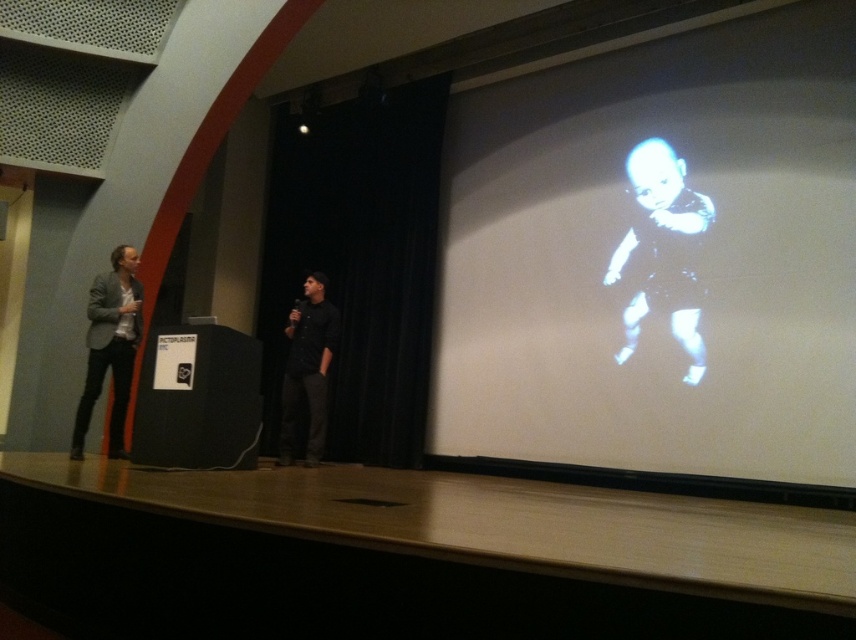
You are an event planner who needs to adjust the lighting for the stage. The white matte projection screen at upper right is represented by point (658, 259). Where should you position the spotlight to ensure it illuminates the screen effectively?

The white matte projection screen at upper right is located at point (658, 259), so the spotlight should be positioned directly facing this coordinate to ensure proper illumination.

You are an event planner setting up the stage for a presentation. You need to adjust the lighting so that the white matte projection screen at upper right and the black matte baby at upper right are both well lit. Considering their positions, which object should you focus the spotlight on first to ensure proper visibility?

The white matte projection screen at upper right is closer to the viewer than the black matte baby at upper right. Therefore, you should focus the spotlight on the white matte projection screen at upper right first to ensure it is properly lit before adjusting for the black matte baby at upper right.

What is the location of the point at coordinates [658,259] in the stage setting?

The point at coordinates [658,259] is located on the white matte projection screen at upper right.